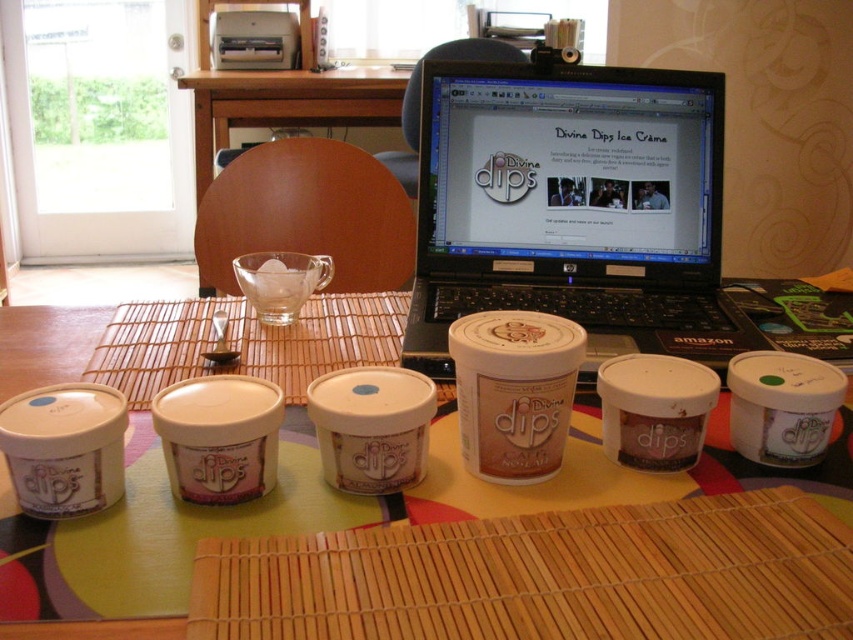
You are placing a decorative plate at the exact center of the table. The white matte container at center is currently at position coordinates. Will the container be moved to make space for the plate?

The white matte container at center is located at point coordinates, so it is not at the exact center of the table. Therefore, the container does not need to be moved to accommodate the decorative plate placed at the table center.

You are organizing a small event and need to know which object takes up more space in the scene. Which is larger between the black plastic laptop at upper center and the green fabric table at center?

The green fabric table at center is larger than the black plastic laptop at upper center according to the description provided.

You are trying to place the white matte container at center on top of the black plastic laptop at upper center. Will it fit without hanging over the edges?

The black plastic laptop at upper center is bigger than the white matte container at center, so the container will fit without hanging over the edges.